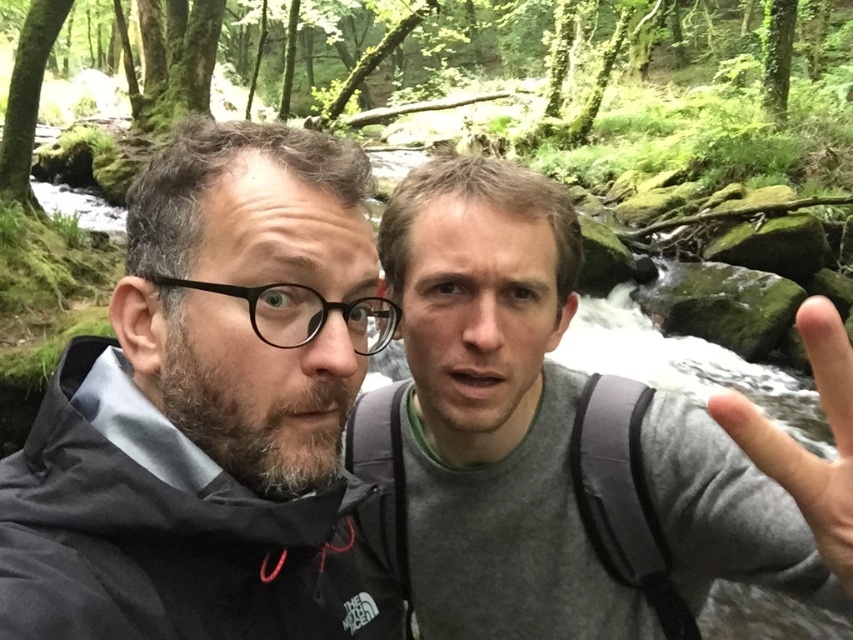
The width and height of the screenshot is (853, 640). Describe the element at coordinates (207, 410) in the screenshot. I see `dark gray jacket at left` at that location.

Which is behind, point (321, 513) or point (778, 474)?

Point (321, 513)

What do you see at coordinates (207, 410) in the screenshot?
I see `dark gray jacket at left` at bounding box center [207, 410].

The height and width of the screenshot is (640, 853). I want to click on dark gray jacket at left, so click(207, 410).

Which is below, dark gray jacket at left or gray fabric backpack at center-right?

dark gray jacket at left

How far apart are dark gray jacket at left and gray fabric backpack at center-right?

dark gray jacket at left is 12.81 inches from gray fabric backpack at center-right.

Does point (321, 588) come closer to viewer compared to point (560, 467)?

That is True.

Locate an element on the screen. dark gray jacket at left is located at coordinates (207, 410).

Can you confirm if gray fabric backpack at center-right is smaller than skinny flesh at center?

No, gray fabric backpack at center-right is not smaller than skinny flesh at center.

Locate an element on the screen. gray fabric backpack at center-right is located at coordinates (482, 419).

Is point (508, 316) in front of point (822, 490)?

No, it is not.

Locate an element on the screen. Image resolution: width=853 pixels, height=640 pixels. gray fabric backpack at center-right is located at coordinates (482, 419).